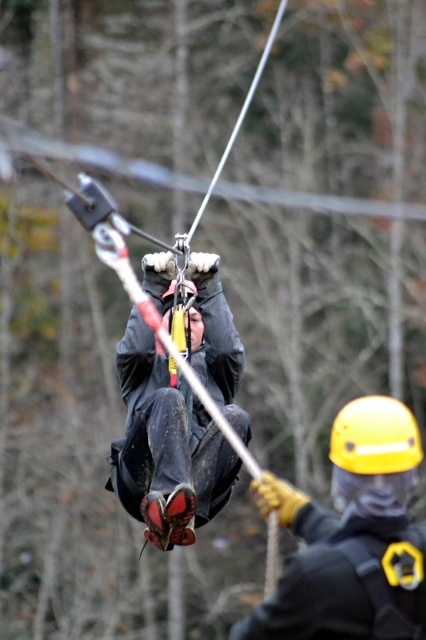
You are a safety inspector checking the equipment in the ziplining scene. You notice two items at the center of the image. Which one is bigger between the yellow hard hat at center and the matte black jacket at center?

The yellow hard hat at center has a larger size compared to the matte black jacket at center, so the yellow hard hat at center is bigger.

You are a safety inspector assessing the distance between the yellow hard hat at center and the matte black jacket at center in the ziplining scene. According to safety regulations, the minimum safe distance between two safety personnel should be 4 meters. Is the current distance compliant with the regulations?

The yellow hard hat at center and matte black jacket at center are 3.84 meters apart from each other, which is less than the required 4 meters. Therefore, the current distance does not comply with the safety regulations.

Consider the image. You are a safety inspector checking the zipline setup. You need to ensure that the yellow hard hat at center is positioned exactly at point [351,538]. Is the yellow hard hat at center placed correctly according to the coordinates?

The yellow hard hat at center is located at point [351,538], so it is placed correctly according to the coordinates.